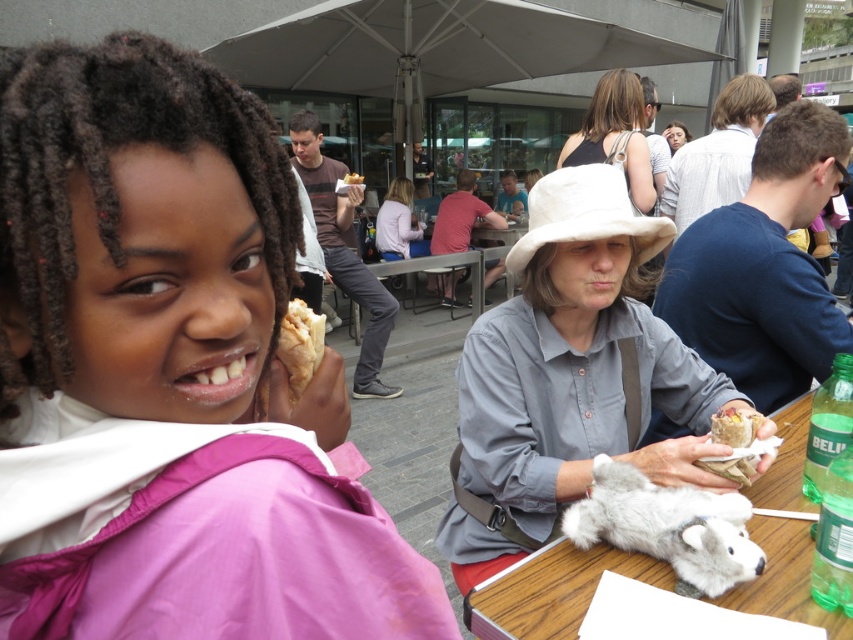
You are a photographer trying to capture the pink fabric jacket at upper left and the matte brown sandwich at lower right in a single frame. Given their sizes, which object will appear bigger in the photo?

The pink fabric jacket at upper left will appear bigger in the photo because it is larger in size than the matte brown sandwich at lower right.

What is the location of the point with coordinates (165, 372) in the image?

The point with coordinates (165, 372) is located on the pink fabric jacket at upper left.